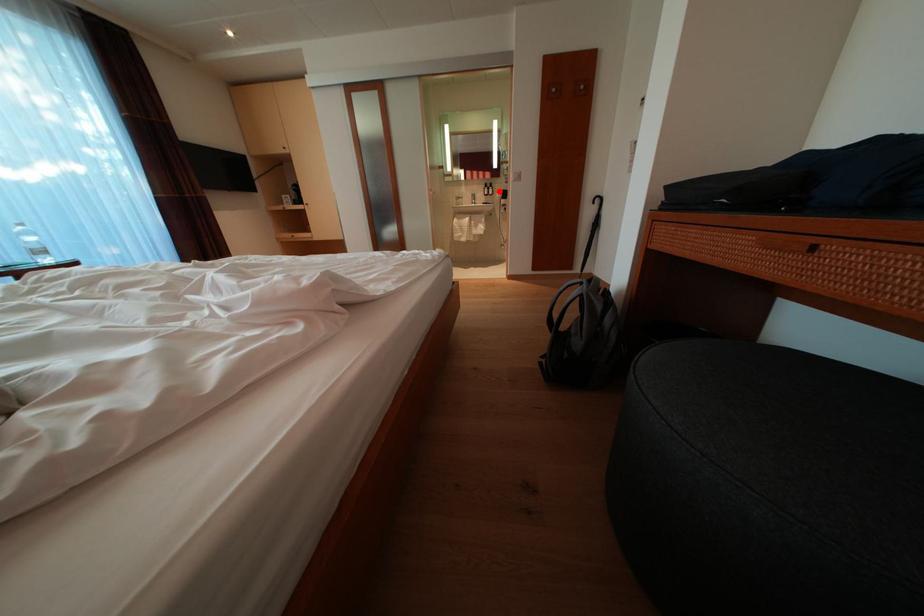
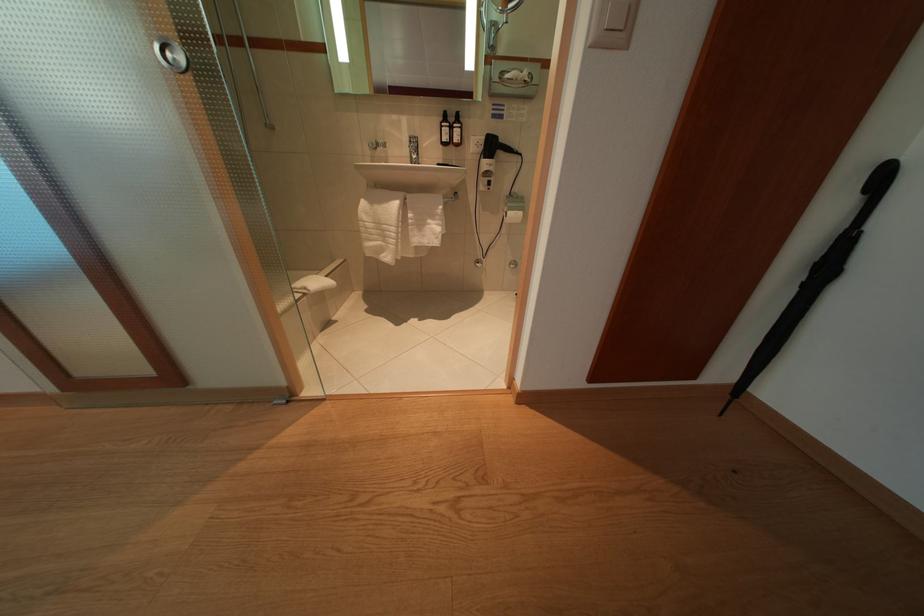
Question: I am providing you with two images of the same scene from different viewpoints. A red point is shown in image1. For the corresponding object point in image2, is it positioned nearer or farther from the camera?

Choices:
 (A) Nearer
 (B) Farther

Answer: (B)